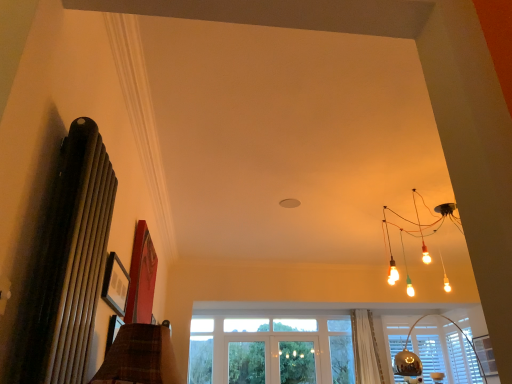
Find the location of a particular element. matte black picture frame at upper left is located at coordinates (115, 284).

Measure the distance between white sheer curtain at lower center and camera.

white sheer curtain at lower center is 5.23 meters away from camera.

Find the location of `matte black picture frame at upper left`. matte black picture frame at upper left is located at coordinates (115, 284).

What's the angular difference between metallic silver lampshade at lower right and translucent glass screen door at center's facing directions?

57 degrees.

Is metallic silver lampshade at lower right at the left side of translucent glass screen door at center?

Incorrect, metallic silver lampshade at lower right is not on the left side of translucent glass screen door at center.

From the picture: From a real-world perspective, does metallic silver lampshade at lower right stand above translucent glass screen door at center?

No, from a real-world perspective, metallic silver lampshade at lower right is not over translucent glass screen door at center

From the image's perspective, which is below, white sheer curtain at lower center or metallic silver lampshade at lower right?

From the image's view, white sheer curtain at lower center is below.

Is metallic silver lampshade at lower right at the back of white sheer curtain at lower center?

No, white sheer curtain at lower center is not facing away from metallic silver lampshade at lower right.

Does point (362, 319) lie in front of point (455, 359)?

That is False.

From a real-world perspective, is white sheer curtain at lower center positioned above or below metallic silver lampshade at lower right?

In terms of real-world spatial position, white sheer curtain at lower center is above metallic silver lampshade at lower right.

Considering the relative sizes of translucent glass screen door at center and white sheer curtain at lower center in the image provided, is translucent glass screen door at center smaller than white sheer curtain at lower center?

Indeed, translucent glass screen door at center has a smaller size compared to white sheer curtain at lower center.

From a real-world perspective, is translucent glass screen door at center above or below white sheer curtain at lower center?

translucent glass screen door at center is below white sheer curtain at lower center.

Considering the points (281, 343) and (372, 340), which point is in front, point (281, 343) or point (372, 340)?

The point (372, 340) is more forward.

Which object is closer to the camera taking this photo, translucent glass screen door at center or white sheer curtain at lower center?

white sheer curtain at lower center is in front.

Looking at their sizes, would you say translucent glass screen door at center is wider or thinner than matte black picture frame at upper left?

translucent glass screen door at center is thinner than matte black picture frame at upper left.

Could you tell me if translucent glass screen door at center is facing matte black picture frame at upper left?

Yes, translucent glass screen door at center is oriented towards matte black picture frame at upper left.

Which is in front, translucent glass screen door at center or matte black picture frame at upper left?

matte black picture frame at upper left is closer to the camera.

Considering the relative sizes of translucent glass screen door at center and matte black picture frame at upper left in the image provided, is translucent glass screen door at center bigger than matte black picture frame at upper left?

Yes, translucent glass screen door at center is bigger than matte black picture frame at upper left.

Can you tell me how much matte black picture frame at upper left and white sheer curtain at lower center differ in facing direction?

The facing directions of matte black picture frame at upper left and white sheer curtain at lower center are 91.3 degrees apart.

Considering the sizes of objects matte black picture frame at upper left and white sheer curtain at lower center in the image provided, who is shorter, matte black picture frame at upper left or white sheer curtain at lower center?

With less height is matte black picture frame at upper left.

Is matte black picture frame at upper left aimed at white sheer curtain at lower center?

No, matte black picture frame at upper left is not oriented towards white sheer curtain at lower center.

From the image's perspective, which one is positioned lower, matte black picture frame at upper left or white sheer curtain at lower center?

white sheer curtain at lower center, from the image's perspective.

From a real-world perspective, between matte black picture frame at upper left and metallic silver lampshade at lower right, who is vertically higher?

matte black picture frame at upper left is physically above.

Does matte black picture frame at upper left contain metallic silver lampshade at lower right?

Actually, metallic silver lampshade at lower right is outside matte black picture frame at upper left.

Considering the relative positions of matte black picture frame at upper left and metallic silver lampshade at lower right in the image provided, is matte black picture frame at upper left in front of metallic silver lampshade at lower right?

Yes, it is in front of metallic silver lampshade at lower right.

Which of these two, matte black picture frame at upper left or metallic silver lampshade at lower right, stands shorter?

matte black picture frame at upper left is shorter.

Is point (124, 292) closer to viewer compared to point (312, 369)?

Yes, point (124, 292) is in front of point (312, 369).

Does matte black picture frame at upper left touch translucent glass screen door at center?

matte black picture frame at upper left is not next to translucent glass screen door at center, and they're not touching.

How much distance is there between matte black picture frame at upper left and translucent glass screen door at center?

matte black picture frame at upper left is 4.15 meters away from translucent glass screen door at center.

Which is behind, matte black picture frame at upper left or translucent glass screen door at center?

translucent glass screen door at center is behind.

Image resolution: width=512 pixels, height=384 pixels. I want to click on screen door on the left of the metallic silver lampshade at lower right, so click(x=297, y=362).

Image resolution: width=512 pixels, height=384 pixels. Identify the location of curtain above the metallic silver lampshade at lower right (from a real-world perspective). (365, 349).

Looking at the image, which one is located closer to matte black picture frame at upper left, translucent glass screen door at center or white sheer curtain at lower center?

white sheer curtain at lower center is closer to matte black picture frame at upper left.

Based on their spatial positions, is white sheer curtain at lower center or metallic silver lampshade at lower right further from translucent glass screen door at center?

metallic silver lampshade at lower right is further to translucent glass screen door at center.

Looking at the image, which one is located closer to white sheer curtain at lower center, matte black picture frame at upper left or metallic silver lampshade at lower right?

The object closer to white sheer curtain at lower center is metallic silver lampshade at lower right.

Looking at the image, which one is located closer to metallic silver lampshade at lower right, matte black picture frame at upper left or translucent glass screen door at center?

translucent glass screen door at center.

Considering their positions, is matte black picture frame at upper left positioned closer to translucent glass screen door at center than metallic silver lampshade at lower right?

The object closer to translucent glass screen door at center is metallic silver lampshade at lower right.

In the scene shown: Which object lies further to the anchor point matte black picture frame at upper left, translucent glass screen door at center or metallic silver lampshade at lower right?

metallic silver lampshade at lower right.

From the image, which object appears to be nearer to white sheer curtain at lower center, translucent glass screen door at center or metallic silver lampshade at lower right?

metallic silver lampshade at lower right lies closer to white sheer curtain at lower center than the other object.

Looking at the image, which one is located closer to metallic silver lampshade at lower right, white sheer curtain at lower center or translucent glass screen door at center?

Based on the image, white sheer curtain at lower center appears to be nearer to metallic silver lampshade at lower right.

Locate an element on the screen. This screenshot has width=512, height=384. window between matte black picture frame at upper left and white sheer curtain at lower center along the z-axis is located at coordinates click(x=438, y=351).

Where is `curtain positioned between metallic silver lampshade at lower right and translucent glass screen door at center from near to far`? curtain positioned between metallic silver lampshade at lower right and translucent glass screen door at center from near to far is located at coordinates (365, 349).

What are the coordinates of `curtain between matte black picture frame at upper left and translucent glass screen door at center along the z-axis` in the screenshot? It's located at (365, 349).

Identify the location of window between matte black picture frame at upper left and translucent glass screen door at center in the front-back direction. (438, 351).